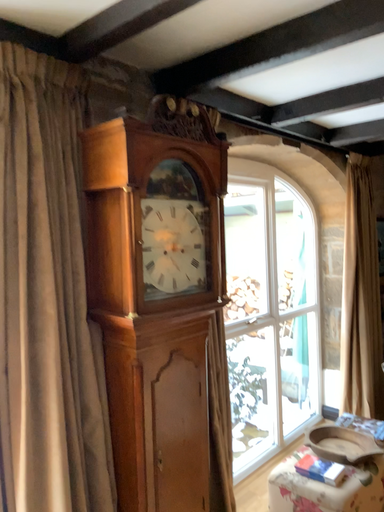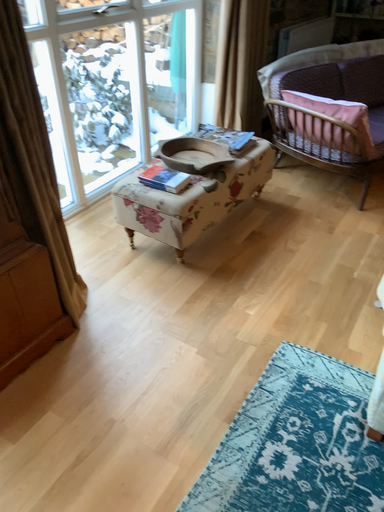
Question: How did the camera likely rotate when shooting the video?

Choices:
 (A) rotated upward
 (B) rotated downward

Answer: (B)